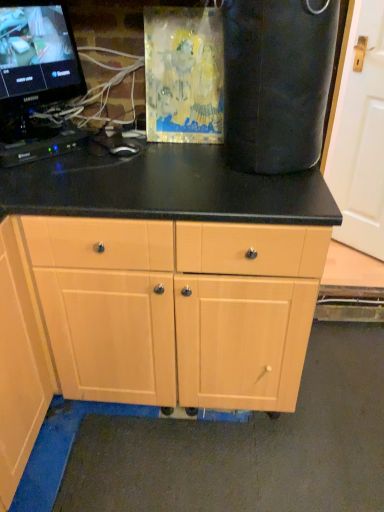
Where is `vacant space in black glossy monitor at upper left (from a real-world perspective)`? vacant space in black glossy monitor at upper left (from a real-world perspective) is located at coordinates (42, 134).